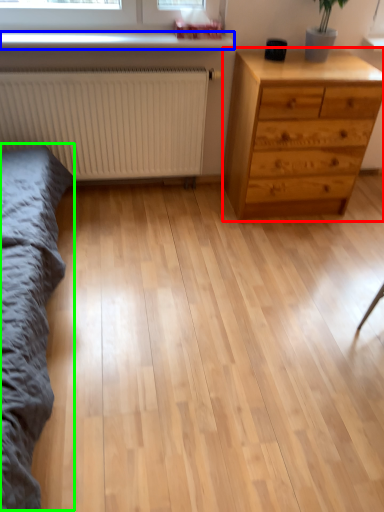
Question: Which object is positioned closest to chest of drawers (highlighted by a red box)? Select from window sill (highlighted by a blue box) and bed frame (highlighted by a green box).

Choices:
 (A) window sill
 (B) bed frame

Answer: (A)